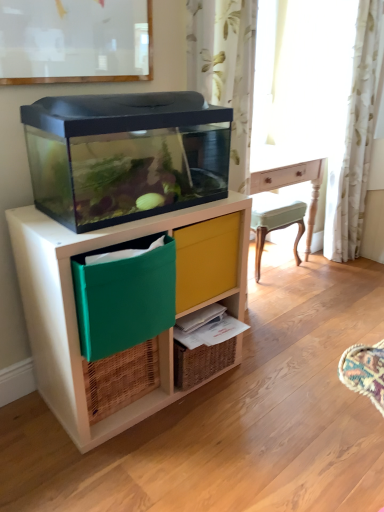
Identify the location of free space on the front side of woven brown basket at lower left. (112, 447).